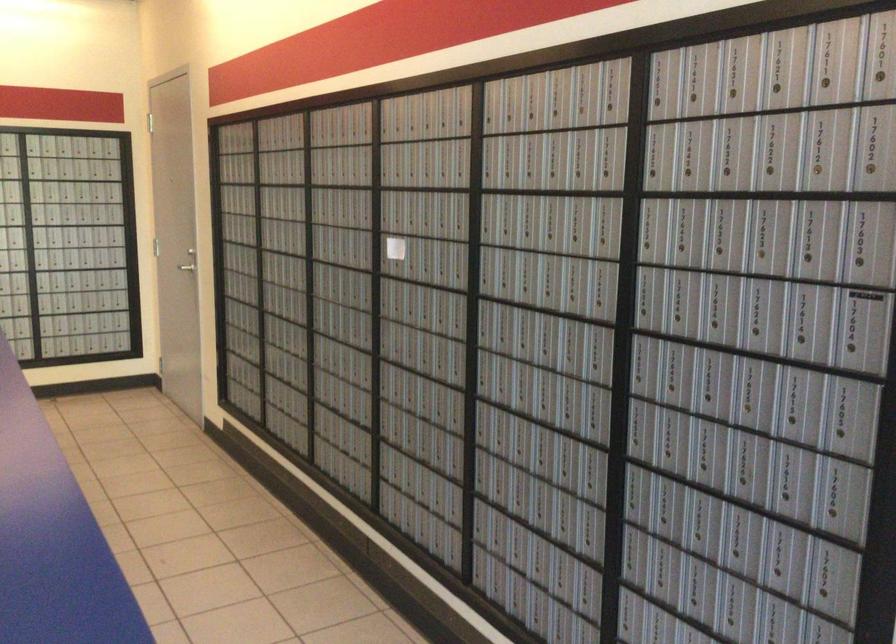
You are a GUI agent. You are given a task and a screenshot of the screen. Output one action in this format:
    pyautogui.click(x=<x>, y=<y>)
    Task: Click on the metal door handle
    
    Given the screenshot: What is the action you would take?
    pyautogui.click(x=188, y=261)